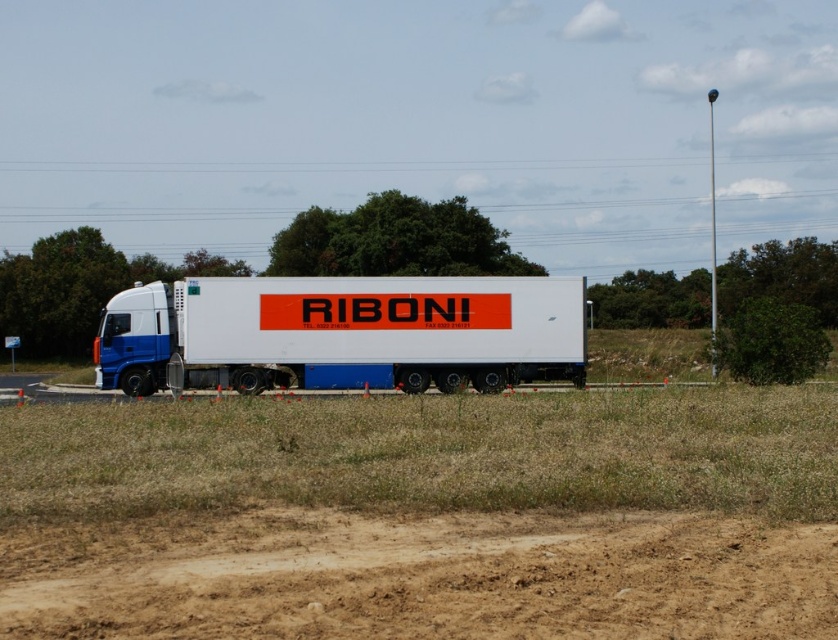
Question: Among these objects, which one is farthest from the camera?

Choices:
 (A) brown sandy dirt track at lower center
 (B) white matte trailer truck at center

Answer: (B)

Question: Which point is farther to the camera?

Choices:
 (A) click(x=322, y=346)
 (B) click(x=370, y=531)

Answer: (A)

Question: Is brown sandy dirt track at lower center smaller than white matte trailer truck at center?

Choices:
 (A) yes
 (B) no

Answer: (A)

Question: Is brown sandy dirt track at lower center thinner than white matte trailer truck at center?

Choices:
 (A) yes
 (B) no

Answer: (A)

Question: Considering the relative positions of brown sandy dirt track at lower center and white matte trailer truck at center in the image provided, where is brown sandy dirt track at lower center located with respect to white matte trailer truck at center?

Choices:
 (A) left
 (B) right

Answer: (B)